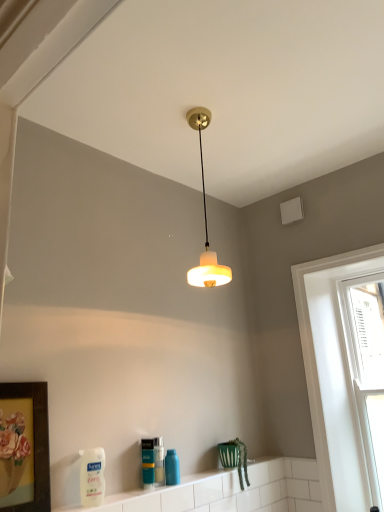
Question: Is point (349, 364) positioned closer to the camera than point (168, 466)?

Choices:
 (A) closer
 (B) farther

Answer: (B)

Question: Is white glossy window at right, the 1th window from the left, to the left or to the right of blue glossy bottle at lower center, placed as the first cleaning product when sorted from right to left, in the image?

Choices:
 (A) left
 (B) right

Answer: (B)

Question: Which of these objects is positioned closest to the white glossy window at right, the 2th window from the right?

Choices:
 (A) blue glossy bottle at lower center, which is the second cleaning product from left to right
 (B) translucent plastic bottle at lower center
 (C) white glossy tile at lower center
 (D) white glass window at right, the 2th window from the left
 (E) wooden framed artwork at lower left

Answer: (D)

Question: Which of these objects is positioned farthest from the white glossy tile at lower center?

Choices:
 (A) white glossy window at right, the 2th window from the right
 (B) white matte bottle at lower left, arranged as the second cleaning product when viewed from the back
 (C) white glass window at right, the 1th window from the right
 (D) translucent glass lampshade at upper center
 (E) translucent plastic bottle at lower center

Answer: (D)